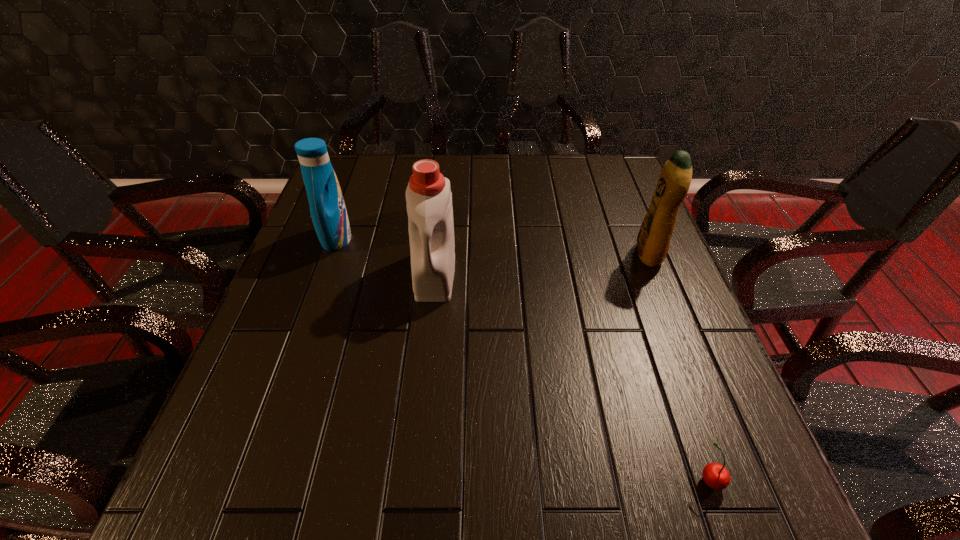
Locate an element on the screen. empty space between the rightmost detergent and the leftmost object is located at coordinates (492, 246).

What are the coordinates of `vacant area that lies between the rightmost detergent and the shortest object` in the screenshot? It's located at (680, 366).

Image resolution: width=960 pixels, height=540 pixels. I want to click on the second closest object relative to the rightmost detergent, so click(x=715, y=475).

Where is `object that ranks as the second closest to the cherry`? This screenshot has height=540, width=960. object that ranks as the second closest to the cherry is located at coordinates (428, 195).

Where is `detergent that is the second closest to the nearest object`? The width and height of the screenshot is (960, 540). detergent that is the second closest to the nearest object is located at coordinates (428, 195).

Choose which detergent is the third nearest neighbor to the nearest object. Please provide its 2D coordinates. Your answer should be formatted as a tuple, i.e. [(x, y)], where the tuple contains the x and y coordinates of a point satisfying the conditions above.

[(328, 211)]

Locate an element on the screen. The width and height of the screenshot is (960, 540). free space that satisfies the following two spatial constraints: 1. on the label of the rightmost detergent; 2. on the handle side of the second object from left to right is located at coordinates coord(657,274).

Identify the location of blank area in the image that satisfies the following two spatial constraints: 1. on the handle side of the shortest object; 2. on the right side of the third object from right to left. The image size is (960, 540). (415, 479).

You are a GUI agent. You are given a task and a screenshot of the screen. Output one action in this format:
    pyautogui.click(x=<x>, y=<y>)
    Task: Click on the free spot that satisfies the following two spatial constraints: 1. on the back side of the nearest object; 2. on the front-facing side of the leftmost object
    
    Given the screenshot: What is the action you would take?
    pyautogui.click(x=624, y=239)

This screenshot has height=540, width=960. I want to click on free location that satisfies the following two spatial constraints: 1. on the front-facing side of the shortest object; 2. on the right side of the leftmost object, so click(x=252, y=479).